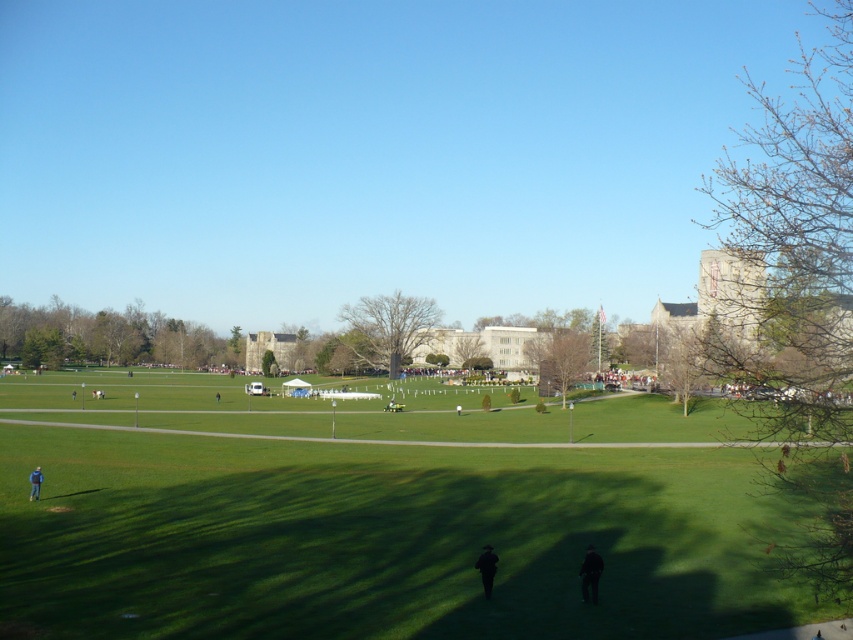
The image size is (853, 640). In order to click on green leafy tree at upper left in this screenshot , I will do `click(107, 337)`.

Which of these two, green leafy tree at upper left or smooth brown tree at center, stands shorter?

With less height is smooth brown tree at center.

Describe the element at coordinates (107, 337) in the screenshot. Image resolution: width=853 pixels, height=640 pixels. I see `green leafy tree at upper left` at that location.

Image resolution: width=853 pixels, height=640 pixels. In order to click on green leafy tree at upper left in this screenshot , I will do `click(107, 337)`.

Is smooth brown tree at center bigger than brown leafy tree at center?

Indeed, smooth brown tree at center has a larger size compared to brown leafy tree at center.

Is point (401, 344) farther from viewer compared to point (552, 339)?

Yes.

You are a GUI agent. You are given a task and a screenshot of the screen. Output one action in this format:
    pyautogui.click(x=<x>, y=<y>)
    Task: Click on the smooth brown tree at center
    
    Given the screenshot: What is the action you would take?
    pyautogui.click(x=387, y=326)

What are the coordinates of `bare branches at right` in the screenshot? It's located at (793, 248).

Where is `bare branches at right`? The height and width of the screenshot is (640, 853). bare branches at right is located at coordinates (793, 248).